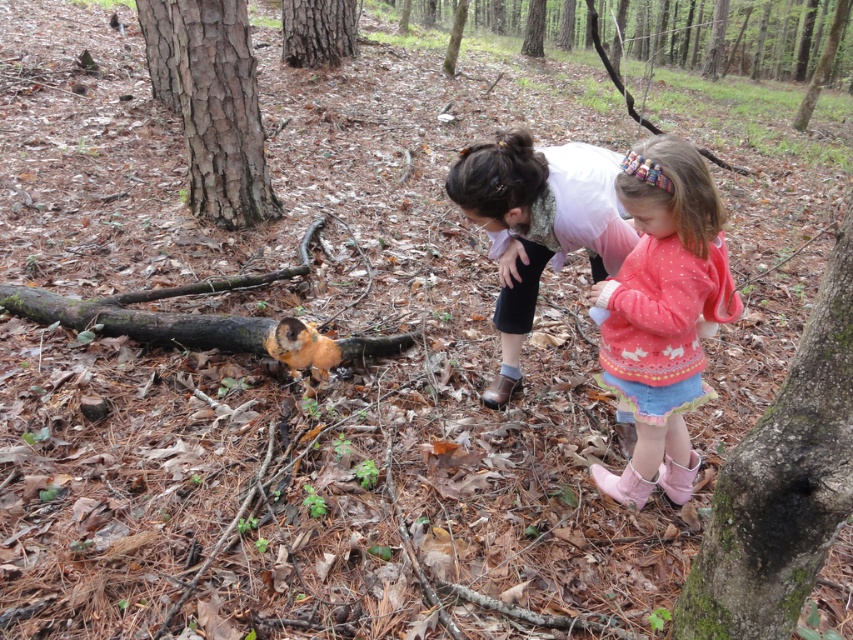
You are a drone operator trying to capture a photo of two points in the forest. The first point is at coordinates point (354,348) and the second is at point (283,48). According to the scene description, which point is closer to the camera?

Point (354,348) is in front of point (283,48), so it is closer to the camera.

You are a parent looking for your child in the forest. You see the pink fabric at center and the smooth brown bark at center. Which object is closer to your right side?

The pink fabric at center is positioned on the right side of smooth brown bark at center, so the pink fabric at center is closer to your right side.

You are a hiker who wants to place a 10 meter long tent between the brown rough log at lower left and the smooth brown bark at center. Is there enough space?

The distance between the brown rough log at lower left and the smooth brown bark at center is 8.82 meters, so the tent is 10 meters long. Therefore, the space is insufficient to accommodate the tent.